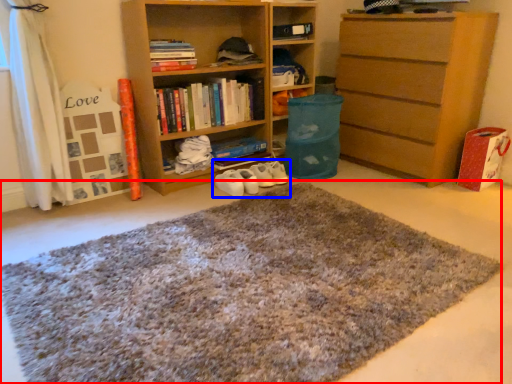
Question: Among these objects, which one is farthest to the camera, doormat (highlighted by a red box) or footwear (highlighted by a blue box)?

Choices:
 (A) doormat
 (B) footwear

Answer: (B)